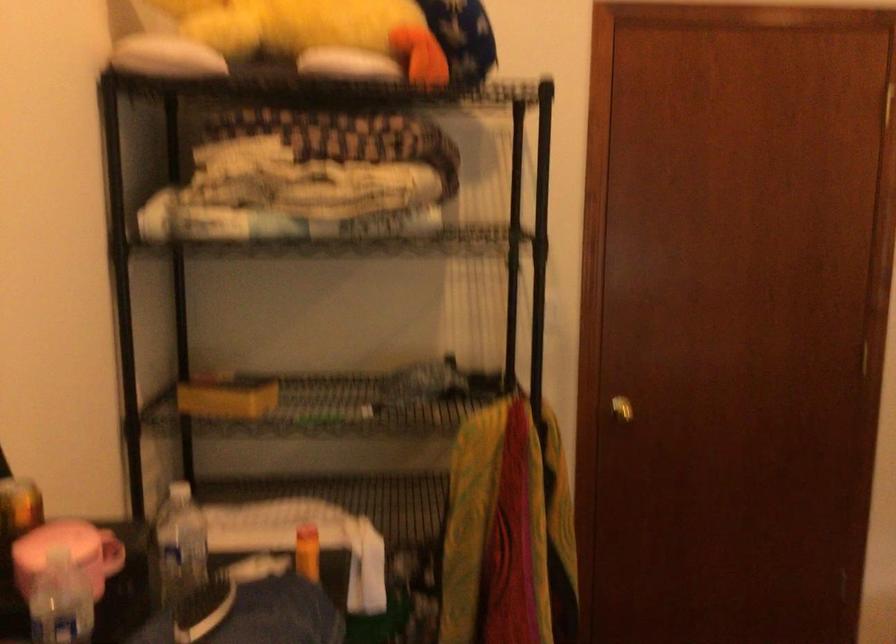
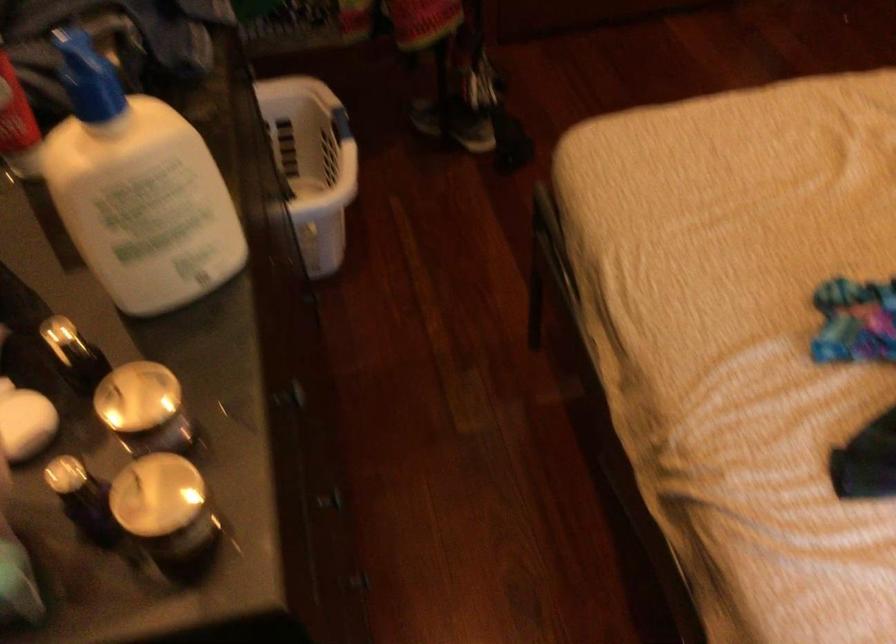
Question: Based on the continuous images, in which direction is the camera rotating? Reply with the corresponding letter.

Choices:
 (A) Left
 (B) Right
 (C) Up
 (D) Down

Answer: (D)